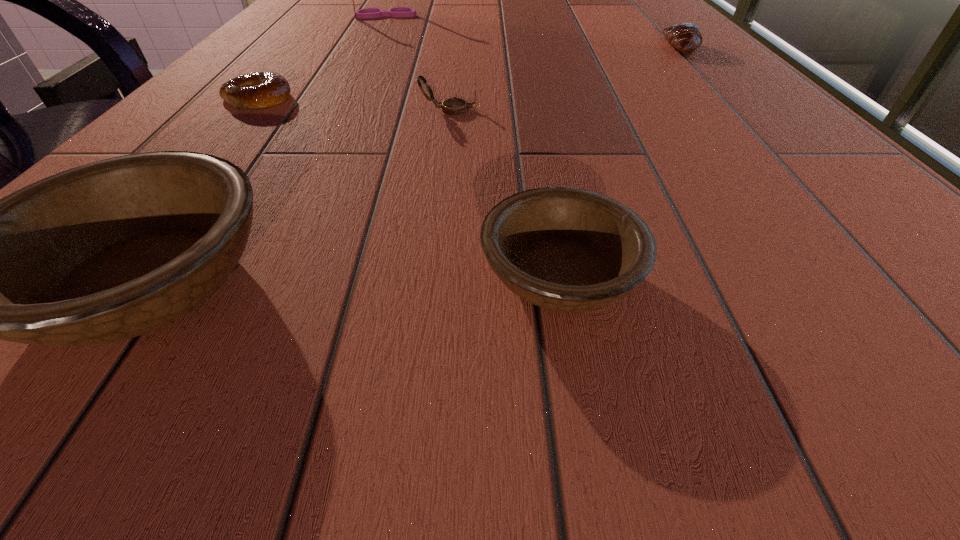
Please point a spot to add another bowl on the right. Please provide its 2D coordinates. Your answer should be formatted as a tuple, i.e. [(x, y)], where the tuple contains the x and y coordinates of a point satisfying the conditions above.

[(956, 267)]